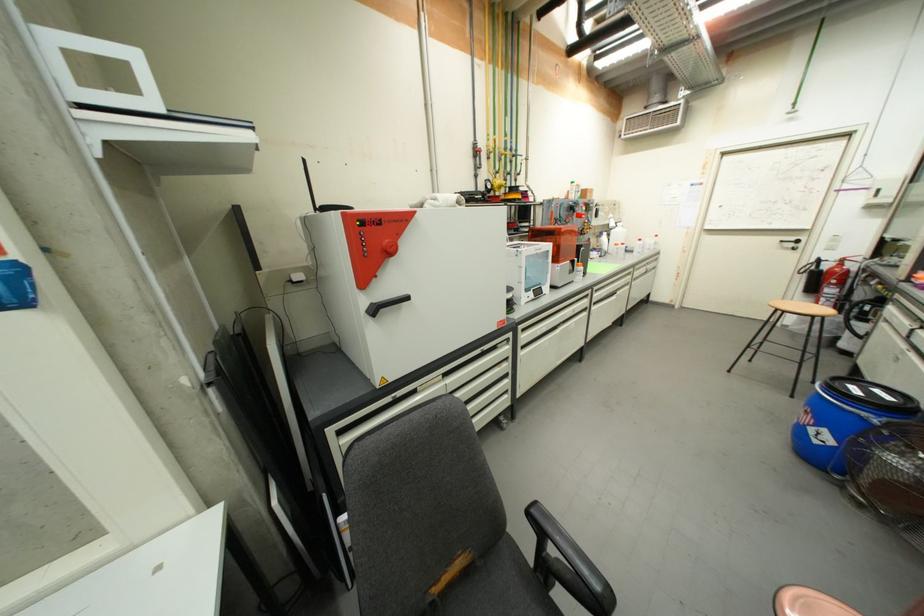
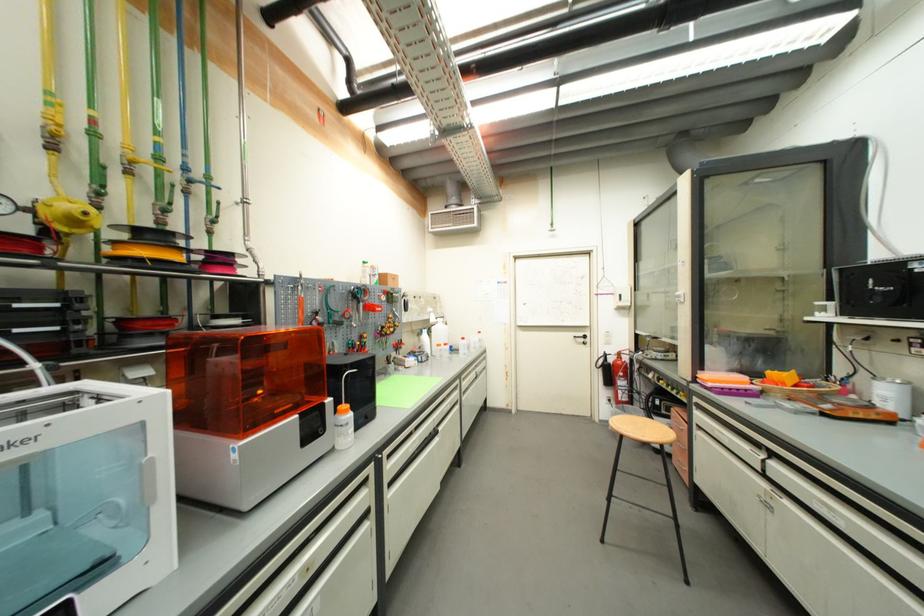
Locate, in the second image, the point that corresponds to (x=786, y=243) in the first image.

(580, 339)